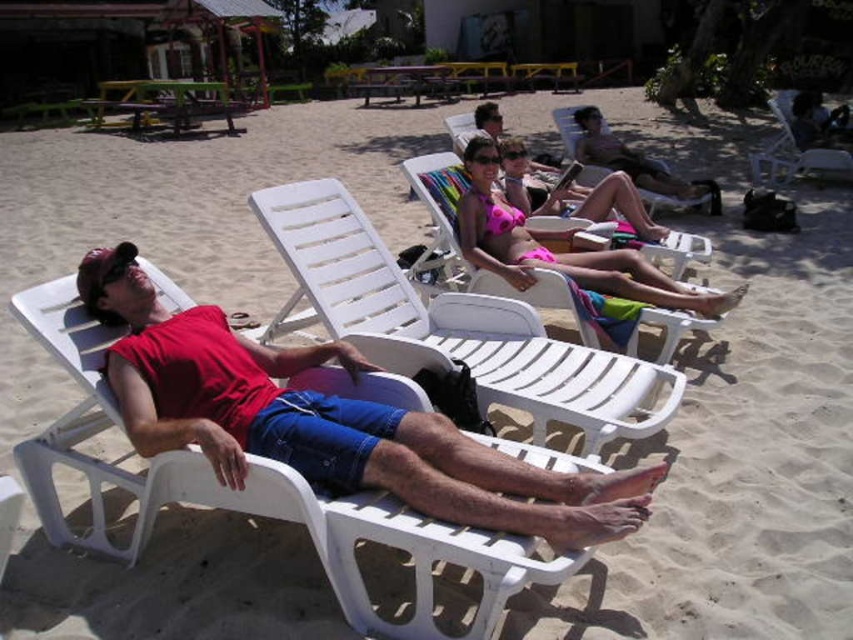
You are a photographer trying to capture the pink fabric bikini at center in the image. Based on the coordinates provided, where should you position your camera to ensure it is centered in your shot?

To center the pink fabric bikini at center in your shot, position your camera at the coordinates point (560, 252) as specified.

You are a photographer positioned at point 0.0, 0.0 trying to capture the pink fabric towel at center. Which direction should you move to get a better shot?

The pink fabric towel at center is located at point (573,195). Since you are at (0,0), you should move towards the northeast direction to align with the towel.

You are standing at the edge of the beach looking towards the loungers. Which of the two points, point (631, 202) or point (585, 108), is closer to you?

Point (631, 202) is closer to the viewer than point (585, 108).